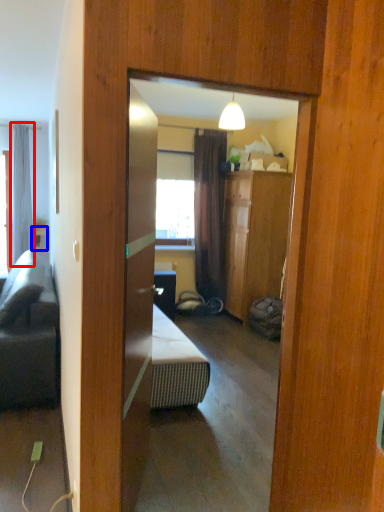
Question: Which object is closer to the camera taking this photo, curtain (highlighted by a red box) or table (highlighted by a blue box)?

Choices:
 (A) curtain
 (B) table

Answer: (A)